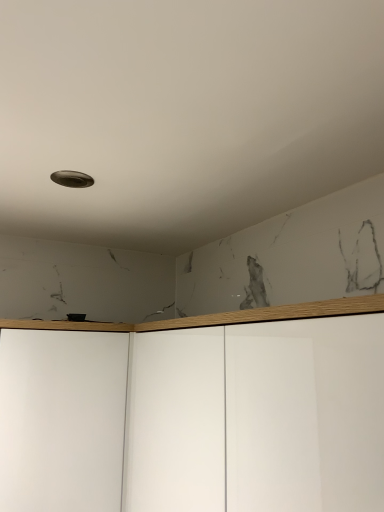
Question: Can you confirm if white matte cabinet at center is thinner than white glossy cabinet at lower left?

Choices:
 (A) yes
 (B) no

Answer: (B)

Question: Is white matte cabinet at center to the right of white glossy cabinet at lower left from the viewer's perspective?

Choices:
 (A) no
 (B) yes

Answer: (B)

Question: Considering the relative sizes of white matte cabinet at center and white glossy cabinet at lower left in the image provided, is white matte cabinet at center smaller than white glossy cabinet at lower left?

Choices:
 (A) yes
 (B) no

Answer: (B)

Question: Can you confirm if white matte cabinet at center is bigger than white glossy cabinet at lower left?

Choices:
 (A) yes
 (B) no

Answer: (A)

Question: Can you confirm if white matte cabinet at center is shorter than white glossy cabinet at lower left?

Choices:
 (A) yes
 (B) no

Answer: (A)

Question: Is white matte cabinet at center located outside white glossy cabinet at lower left?

Choices:
 (A) yes
 (B) no

Answer: (A)

Question: Could you tell me if white glossy cabinet at lower left is turned towards white matte cabinet at center?

Choices:
 (A) yes
 (B) no

Answer: (B)

Question: Is white glossy cabinet at lower left at the left side of white matte cabinet at center?

Choices:
 (A) yes
 (B) no

Answer: (A)

Question: From the image's perspective, is white glossy cabinet at lower left beneath white matte cabinet at center?

Choices:
 (A) yes
 (B) no

Answer: (A)

Question: Can you confirm if white glossy cabinet at lower left is taller than white matte cabinet at center?

Choices:
 (A) no
 (B) yes

Answer: (B)

Question: Considering the relative sizes of white glossy cabinet at lower left and white matte cabinet at center in the image provided, is white glossy cabinet at lower left bigger than white matte cabinet at center?

Choices:
 (A) yes
 (B) no

Answer: (B)

Question: Does white glossy cabinet at lower left have a lesser height compared to white matte cabinet at center?

Choices:
 (A) yes
 (B) no

Answer: (B)

Question: From their relative heights in the image, would you say white matte cabinet at center is taller or shorter than white glossy cabinet at lower left?

Choices:
 (A) short
 (B) tall

Answer: (A)